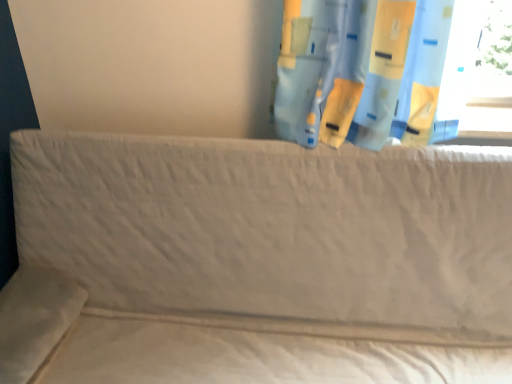
Describe the element at coordinates (257, 262) in the screenshot. The height and width of the screenshot is (384, 512). I see `white fabric couch at center` at that location.

You are a GUI agent. You are given a task and a screenshot of the screen. Output one action in this format:
    pyautogui.click(x=<x>, y=<y>)
    Task: Click on the white fabric couch at center
    
    Given the screenshot: What is the action you would take?
    pyautogui.click(x=257, y=262)

Find the location of a particular element. white fabric couch at center is located at coordinates (257, 262).